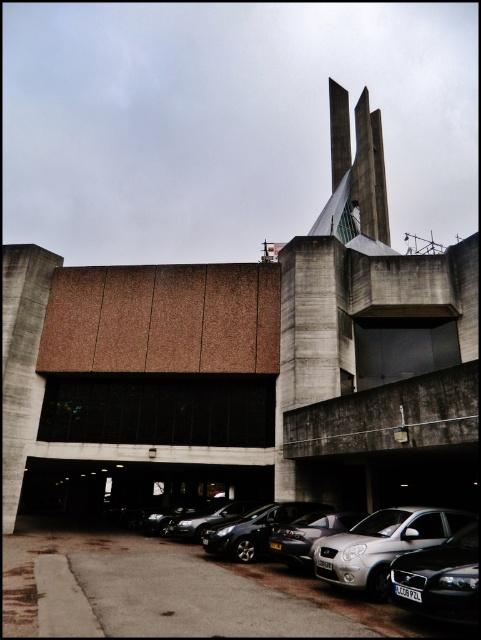
You are a visitor arriving at the modern building and need to park your car. You see a black metallic car at lower right and a silver metallic hatchback at center. Which parking spot can accommodate a larger vehicle?

The silver metallic hatchback at center can accommodate a larger vehicle since it is larger than the black metallic car at lower right.

You are a delivery driver who needs to park your truck, which is 5 meters long, in the parking lot shown in the image. The parking lot has spaces between the silver metallic hatchback at lower right and the black metallic car at lower right. Can your truck fit there?

The silver metallic hatchback at lower right is larger than the black metallic car at lower right. However, the exact dimensions of the parking space between them are not specified. Without knowing the length of the space, it is impossible to determine if the truck can fit.

You are standing in front of the modern architectural structure and want to park your car. You see a black metallic car at lower right and a silver metallic hatchback at center. Which parking spot is closer to you?

The black metallic car at lower right is closer to the viewer than the silver metallic hatchback at center, so the parking spot where the black metallic car at lower right is parked is closer to you.